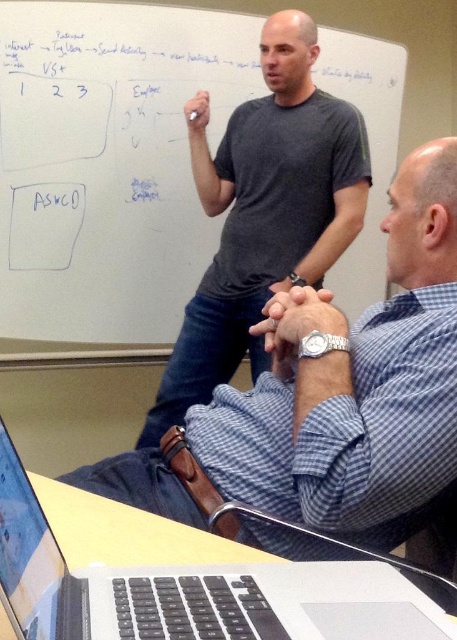
Does point (145, 67) lie behind point (21, 545)?

Yes, it is.

Which is in front, point (43, 212) or point (363, 604)?

Point (363, 604)

Image resolution: width=457 pixels, height=640 pixels. Describe the element at coordinates (107, 168) in the screenshot. I see `white matte board at upper center` at that location.

The image size is (457, 640). What are the coordinates of `white matte board at upper center` in the screenshot? It's located at (107, 168).

Is the position of white matte board at upper center less distant than that of blue checkered shirt at center?

That is False.

Which is behind, point (179, 36) or point (428, 305)?

The point (179, 36) is more distant.

At what (x,y) coordinates should I click in order to perform the action: click on white matte board at upper center. Please return your answer as a coordinate pair (x, y). Looking at the image, I should click on (107, 168).

In the scene shown: Who is positioned more to the right, blue checkered shirt at center or silver/black plastic laptop at lower center?

From the viewer's perspective, blue checkered shirt at center appears more on the right side.

Is point (432, 234) in front of point (83, 573)?

No.

Locate an element on the screen. The width and height of the screenshot is (457, 640). blue checkered shirt at center is located at coordinates (354, 387).